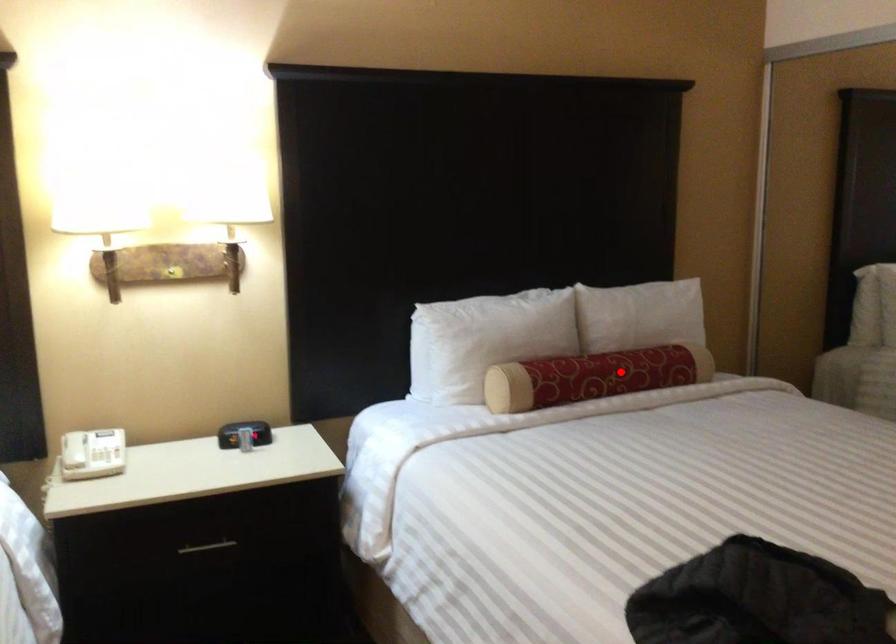
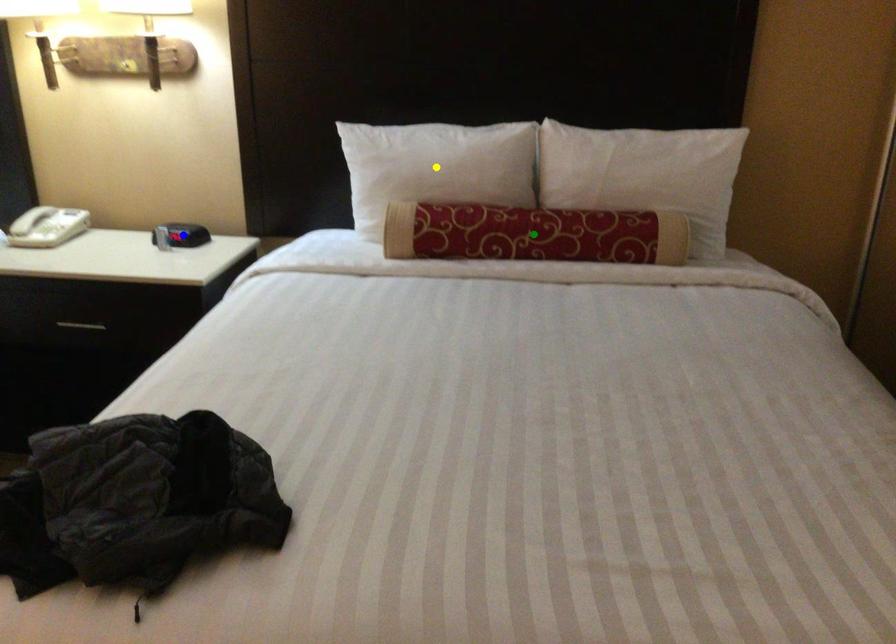
Question: I am providing you with two images of the same scene from different viewpoints. A red point is marked on the first image. You are given multiple points on the second image. Which point in image 2 represents the same 3d spot as the red point in image 1?

Choices:
 (A) blue point
 (B) green point
 (C) yellow point

Answer: (B)